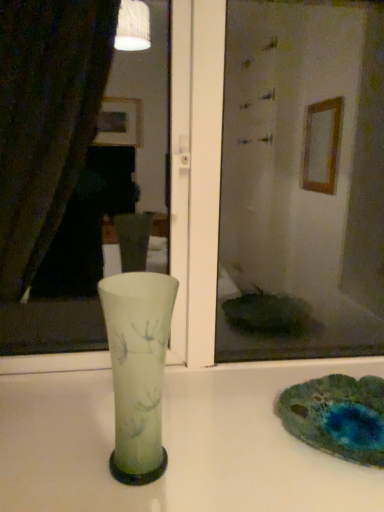
In order to click on vacant space situated on the left part of frosted glass vase at center in this screenshot , I will do pyautogui.click(x=53, y=461).